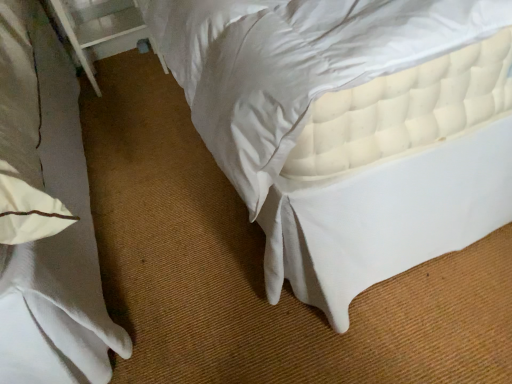
The height and width of the screenshot is (384, 512). Find the location of `white plastic balustrade at upper left`. white plastic balustrade at upper left is located at coordinates (97, 27).

What do you see at coordinates (97, 27) in the screenshot? The image size is (512, 384). I see `white plastic balustrade at upper left` at bounding box center [97, 27].

What are the coordinates of `white quilted mattress at upper right` in the screenshot? It's located at (351, 129).

What do you see at coordinates (351, 129) in the screenshot?
I see `white quilted mattress at upper right` at bounding box center [351, 129].

I want to click on white plastic balustrade at upper left, so click(x=97, y=27).

Which object is positioned more to the left, white plastic balustrade at upper left or white quilted mattress at upper right?

white plastic balustrade at upper left.

Relative to white quilted mattress at upper right, is white plastic balustrade at upper left in front or behind?

white plastic balustrade at upper left is positioned farther from the viewer than white quilted mattress at upper right.

Does point (96, 38) come behind point (438, 66)?

Yes, it is.

From the image's perspective, which one is positioned lower, white plastic balustrade at upper left or white quilted mattress at upper right?

white quilted mattress at upper right is shown below in the image.

From a real-world perspective, which object stands above the other?

white plastic balustrade at upper left, from a real-world perspective.

Considering the sizes of objects white plastic balustrade at upper left and white quilted mattress at upper right in the image provided, who is wider, white plastic balustrade at upper left or white quilted mattress at upper right?

white quilted mattress at upper right.

Considering the sizes of objects white plastic balustrade at upper left and white quilted mattress at upper right in the image provided, who is taller, white plastic balustrade at upper left or white quilted mattress at upper right?

Standing taller between the two is white plastic balustrade at upper left.

Considering the sizes of objects white plastic balustrade at upper left and white quilted mattress at upper right in the image provided, who is smaller, white plastic balustrade at upper left or white quilted mattress at upper right?

white plastic balustrade at upper left is smaller.

Is white quilted mattress at upper right a part of white plastic balustrade at upper left?

No, white quilted mattress at upper right is not surrounded by white plastic balustrade at upper left.

Is white plastic balustrade at upper left touching white quilted mattress at upper right?

No, white plastic balustrade at upper left is not next to white quilted mattress at upper right.

Is white plastic balustrade at upper left positioned with its back to white quilted mattress at upper right?

No, white plastic balustrade at upper left is not facing the opposite direction of white quilted mattress at upper right.

Locate an element on the screen. Image resolution: width=512 pixels, height=384 pixels. balustrade behind the white quilted mattress at upper right is located at coordinates (97, 27).

Which object is positioned more to the right, white quilted mattress at upper right or white plastic balustrade at upper left?

white quilted mattress at upper right is more to the right.

Looking at this image, which is behind, white quilted mattress at upper right or white plastic balustrade at upper left?

white plastic balustrade at upper left is behind.

Which is in front, point (422, 176) or point (84, 55)?

The point (422, 176) is closer to the camera.

From the image's perspective, which object appears higher, white quilted mattress at upper right or white plastic balustrade at upper left?

white plastic balustrade at upper left.

From a real-world perspective, is white quilted mattress at upper right above or below white plastic balustrade at upper left?

white quilted mattress at upper right is below white plastic balustrade at upper left.

Can you confirm if white quilted mattress at upper right is thinner than white plastic balustrade at upper left?

In fact, white quilted mattress at upper right might be wider than white plastic balustrade at upper left.

Which of these two, white quilted mattress at upper right or white plastic balustrade at upper left, stands shorter?

With less height is white quilted mattress at upper right.

Looking at the image, does white quilted mattress at upper right seem bigger or smaller compared to white plastic balustrade at upper left?

Considering their sizes, white quilted mattress at upper right takes up more space than white plastic balustrade at upper left.

Is white quilted mattress at upper right not within white plastic balustrade at upper left?

Yes.

Is white quilted mattress at upper right with white plastic balustrade at upper left?

white quilted mattress at upper right is not next to white plastic balustrade at upper left, and they're not touching.

Is white quilted mattress at upper right aimed at white plastic balustrade at upper left?

No, white quilted mattress at upper right does not turn towards white plastic balustrade at upper left.

How many degrees apart are the facing directions of white quilted mattress at upper right and white plastic balustrade at upper left?

There is a 178-degree angle between the facing directions of white quilted mattress at upper right and white plastic balustrade at upper left.

Could you measure the distance between white quilted mattress at upper right and white plastic balustrade at upper left?

white quilted mattress at upper right and white plastic balustrade at upper left are 4.75 feet apart from each other.

The height and width of the screenshot is (384, 512). I want to click on balustrade above the white quilted mattress at upper right (from a real-world perspective), so click(97, 27).

What are the coordinates of `bed below the white plastic balustrade at upper left (from a real-world perspective)` in the screenshot? It's located at (351, 129).

Find the location of a particular element. The image size is (512, 384). balustrade located above the white quilted mattress at upper right (from a real-world perspective) is located at coordinates (97, 27).